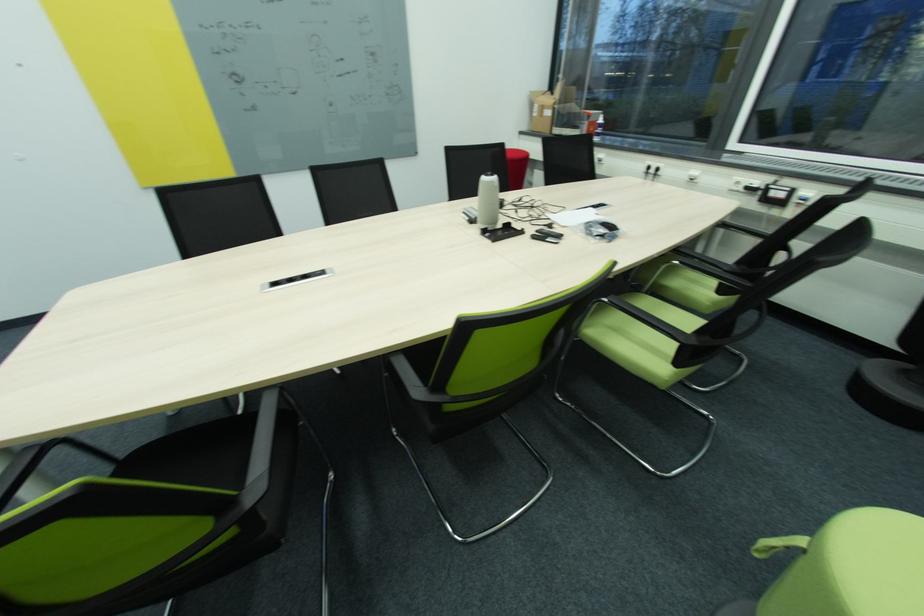
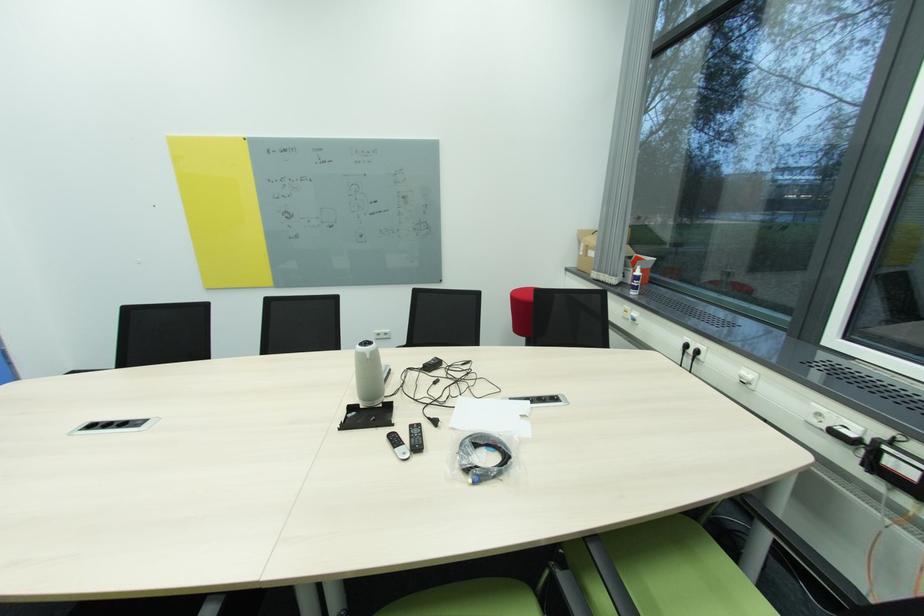
Locate, in the second image, the point that corresponds to point (541, 232) in the first image.

(416, 427)